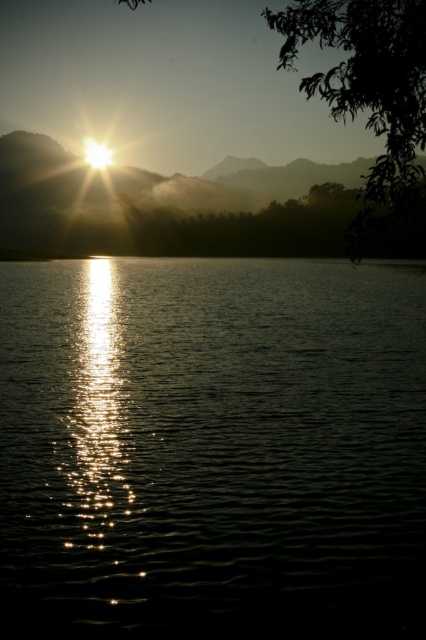
You are standing in the serene sunset scene and want to walk from the point at coordinates point (25, 401) to the point at coordinates point (374, 45). Since both points are on the water, will you have to wade through deeper water as you move from the first point to the second?

Point (25, 401) is further to the camera than point (374, 45). Since the point you start at is closer to you, the water depth might increase as you move towards the point further away, but the scene description mentions the water is calm with gentle ripples, so it should remain navigable.

You are standing at the edge of the water in the sunset scene. There is a point marked at coordinates (x=212, y=448). Where is this point located in relation to the glistening liquid at center?

The point at (x=212, y=448) is located on the glistening liquid at center.